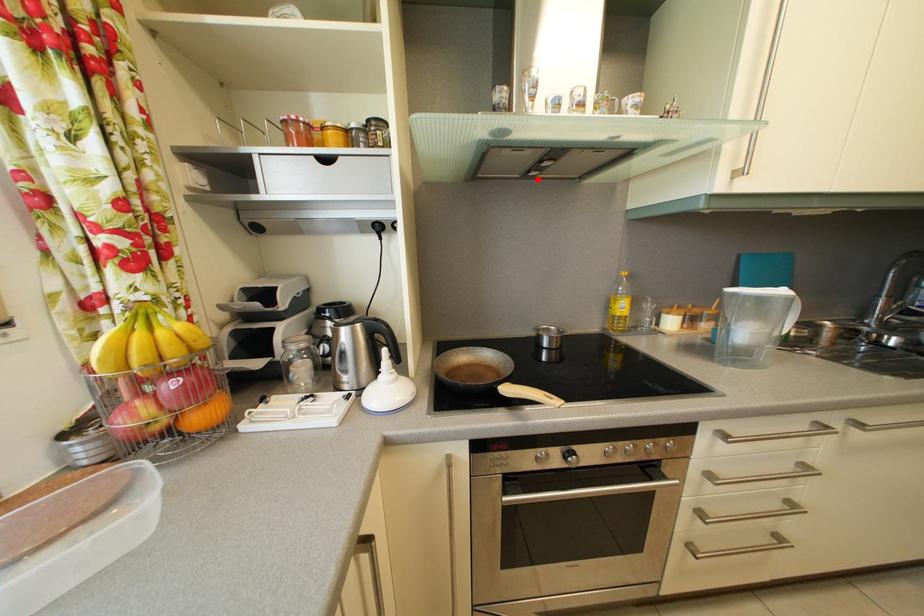
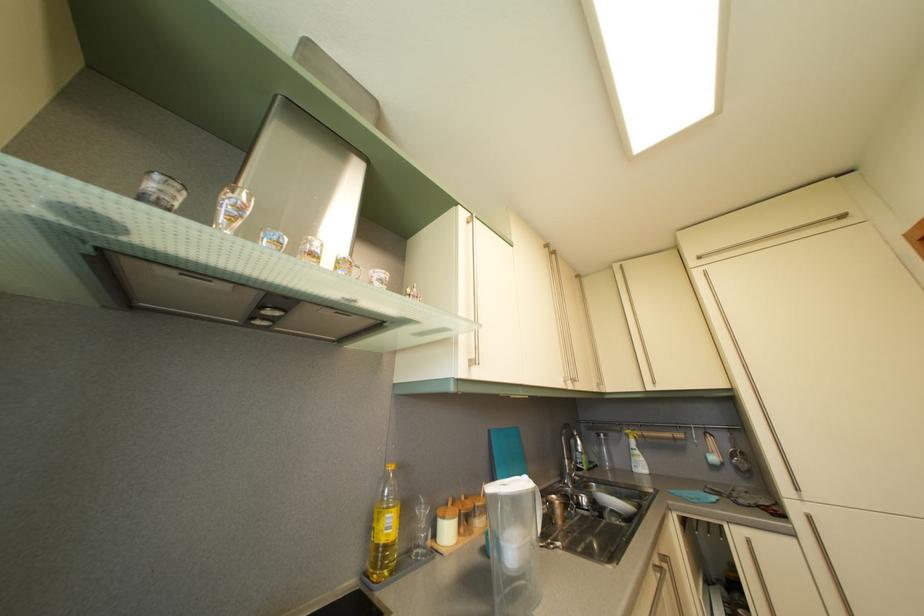
In the second image, find the point that corresponds to the highlighted location in the first image.

(261, 326)